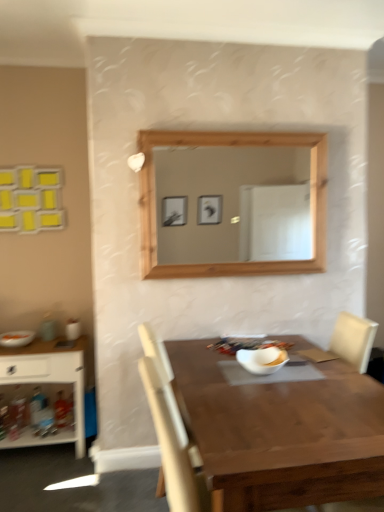
Identify the location of vacant space in front of white matte bowl at center, marked as the second food in a left-to-right arrangement. [x=276, y=388].